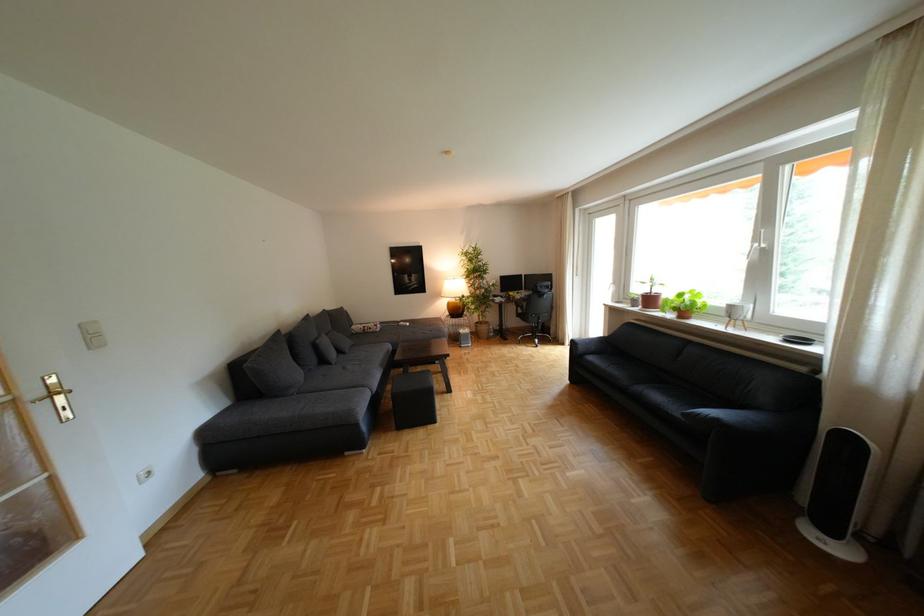
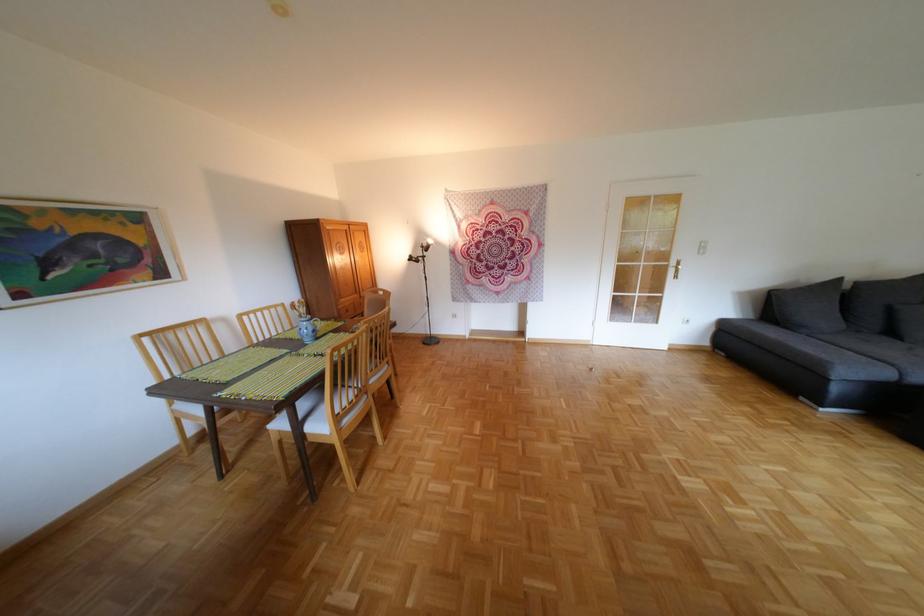
The point at (x=26, y=402) is marked in the first image. Where is the corresponding point in the second image?

(679, 265)